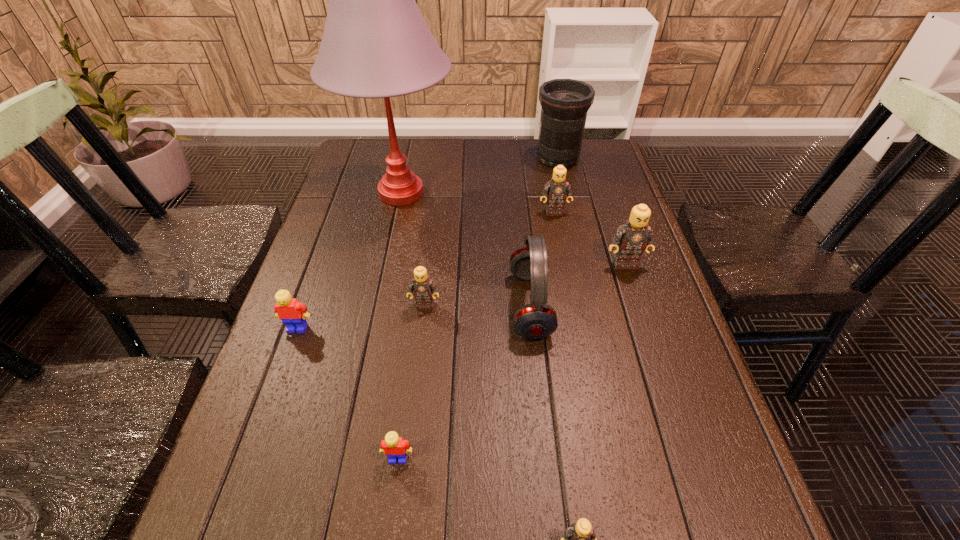
In order to click on the second smallest tan Lego in this screenshot , I will do `click(422, 286)`.

Find the location of a particular element. Image resolution: width=960 pixels, height=540 pixels. the fourth nearest Lego is located at coordinates (422, 286).

Where is `the smaller yellow Lego`? the smaller yellow Lego is located at coordinates (393, 446).

Where is `the right yellow Lego`? This screenshot has width=960, height=540. the right yellow Lego is located at coordinates (393, 446).

Find the location of a particular element. This screenshot has width=960, height=540. vacant space located 0.360m on the front-facing side of the light table lamp is located at coordinates (576, 193).

At what (x,y) coordinates should I click in order to perform the action: click on vacant space located on the front of the eighth shortest object. Please return your answer as a coordinate pair (x, y). The height and width of the screenshot is (540, 960). Looking at the image, I should click on (564, 186).

Image resolution: width=960 pixels, height=540 pixels. What are the coordinates of `blank space located 0.070m on the ear cups of the red earphone` in the screenshot? It's located at (481, 305).

Find the location of a particular element. blank area located on the ear cups of the red earphone is located at coordinates (464, 305).

You are a GUI agent. You are given a task and a screenshot of the screen. Output one action in this format:
    pyautogui.click(x=<x>, y=<y>)
    Task: Click on the vacant position located on the ear cups of the red earphone
    
    Given the screenshot: What is the action you would take?
    pyautogui.click(x=395, y=305)

At what (x,y) coordinates should I click in order to perform the action: click on vacant space situated in front of the biggest tan Lego. Please return your answer as a coordinate pair (x, y). Looking at the image, I should click on (666, 391).